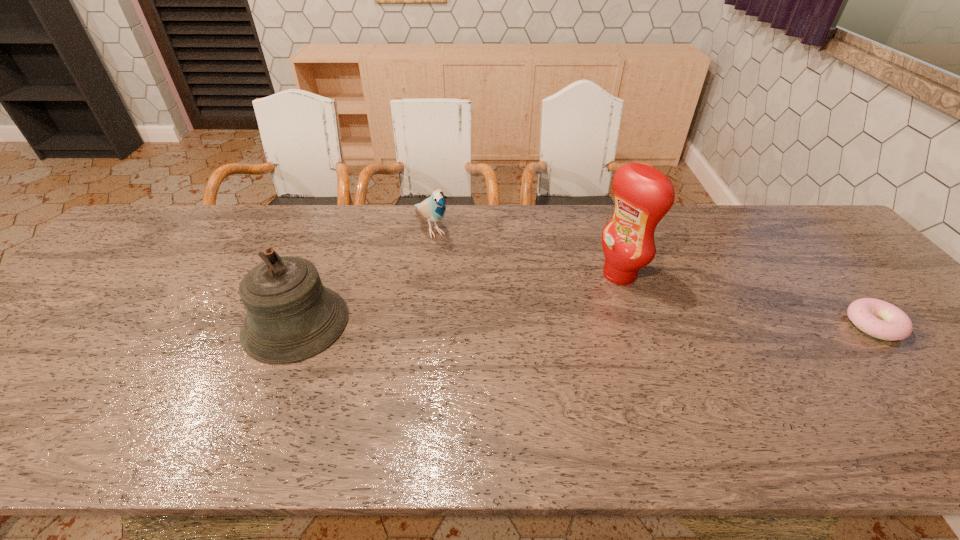
The width and height of the screenshot is (960, 540). Find the location of `vacant spot on the desktop that is between the bell and the doughnut and is positioned on the label side of the third object from left to right`. vacant spot on the desktop that is between the bell and the doughnut and is positioned on the label side of the third object from left to right is located at coordinates (525, 324).

In order to click on free space on the desktop that is between the third shortest object and the rightmost object and is positioned at the face of the second shortest object in this screenshot , I will do `click(502, 323)`.